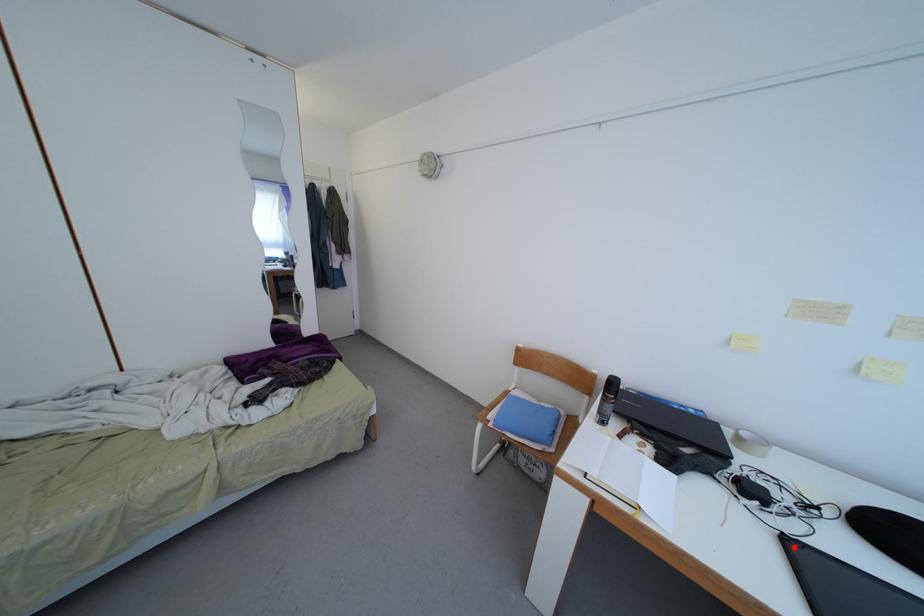
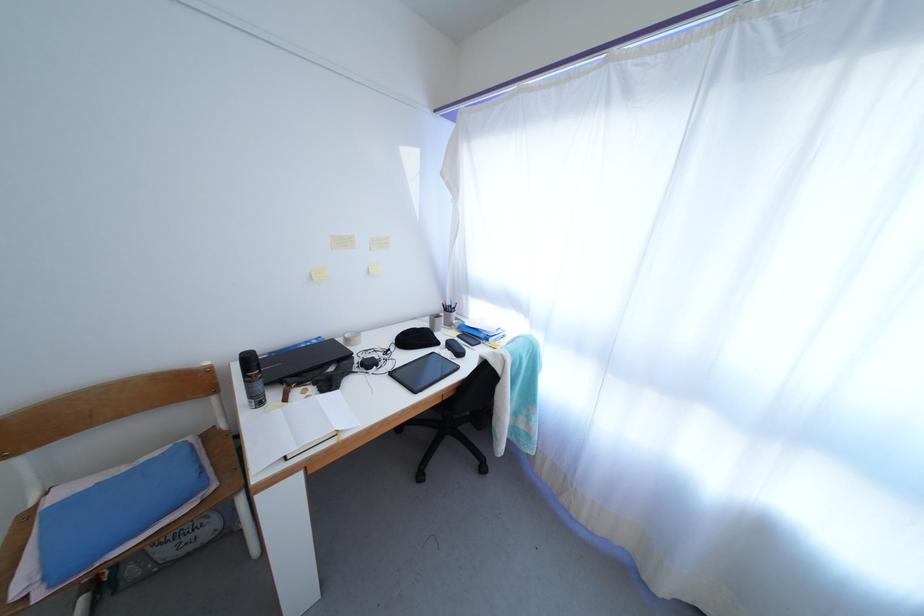
The point at the highlighted location is marked in the first image. Where is the corresponding point in the second image?

(397, 379)